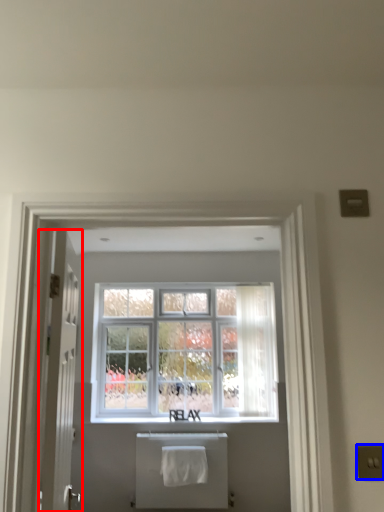
Question: Which object is further to the camera taking this photo, door (highlighted by a red box) or electric outlet (highlighted by a blue box)?

Choices:
 (A) door
 (B) electric outlet

Answer: (A)